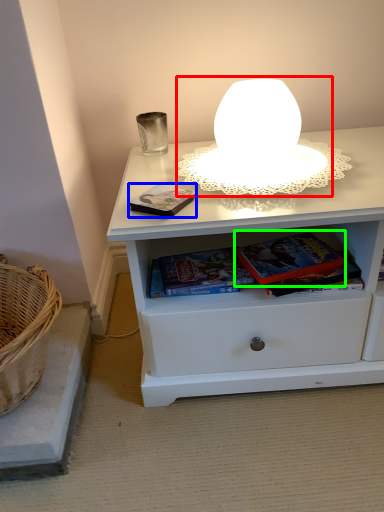
Question: Considering the real-world distances, which object is closest to table lamp (highlighted by a red box)? paperback book (highlighted by a blue box) or paperback book (highlighted by a green box).

Choices:
 (A) paperback book
 (B) paperback book

Answer: (A)